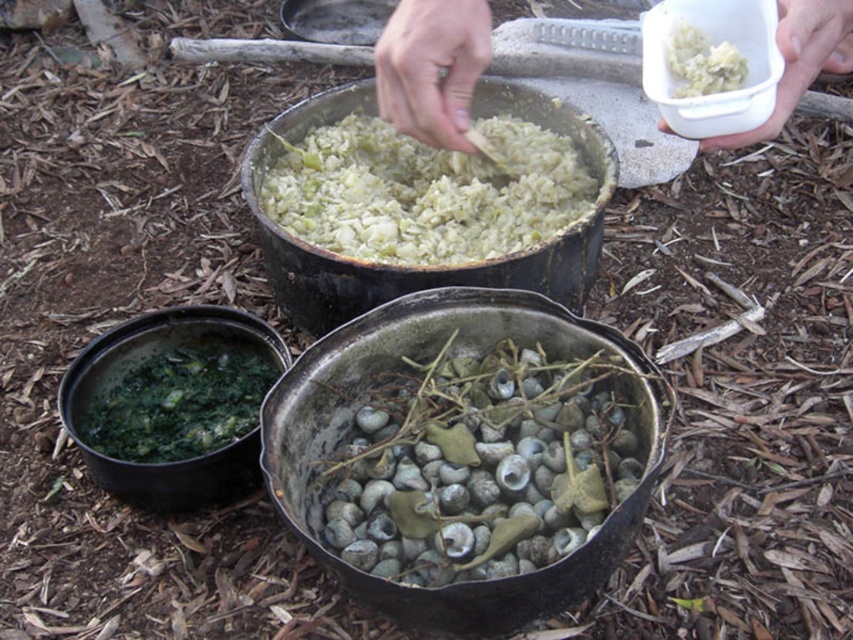
Is point (399, 250) farther from viewer compared to point (786, 99)?

That is True.

Who is more distant from viewer, (413, 186) or (778, 108)?

The point (413, 186) is behind.

Measure the distance between point (323, 195) and camera.

They are 5.42 feet apart.

This screenshot has width=853, height=640. I want to click on green matte rice at center, so click(x=424, y=193).

Between point (448, 212) and point (706, 76), which one is positioned behind?

The point (448, 212) is more distant.

Does point (480, 129) come behind point (741, 84)?

Yes, it is behind point (741, 84).

The image size is (853, 640). I want to click on green matte rice at center, so click(x=424, y=193).

Does greenish-gray shells at center lie in front of white plastic container at upper center?

No.

Does point (451, 499) come behind point (454, 58)?

Yes, point (451, 499) is farther from viewer.

Image resolution: width=853 pixels, height=640 pixels. Find the location of `greenish-gray shells at center`. greenish-gray shells at center is located at coordinates (480, 465).

Locate an element on the screen. This screenshot has width=853, height=640. greenish-gray shells at center is located at coordinates (480, 465).